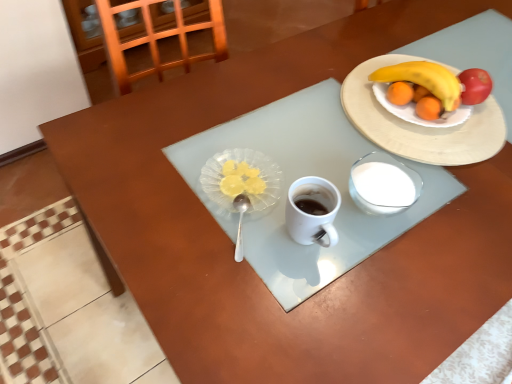
Locate an element on the screen. This screenshot has height=384, width=512. vacant area that lies between translucent glass plate at center and yellow matte banana at upper right is located at coordinates (319, 145).